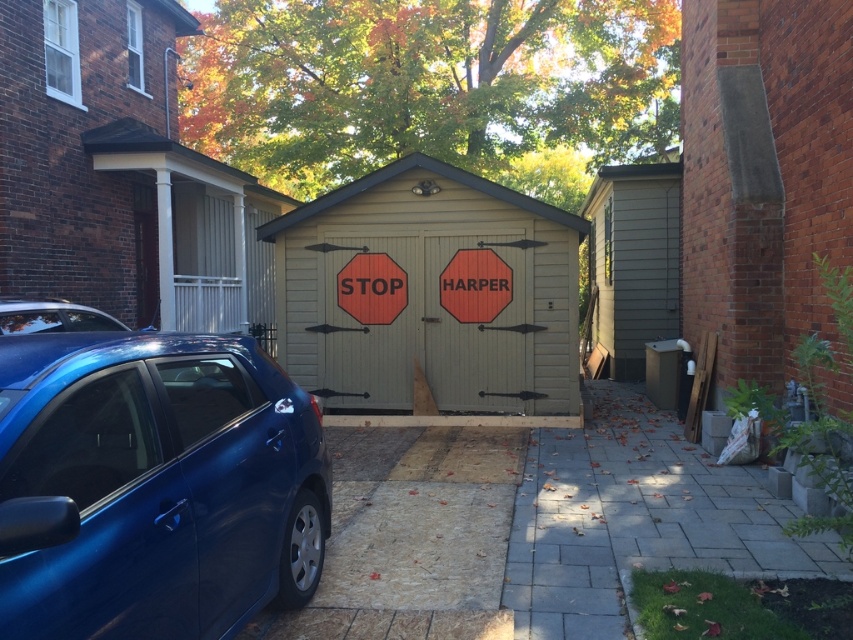
Can you confirm if smooth concrete driveway at center is positioned to the right of matte wood stop sign at center?

Indeed, smooth concrete driveway at center is positioned on the right side of matte wood stop sign at center.

This screenshot has width=853, height=640. What do you see at coordinates (413, 538) in the screenshot? I see `smooth concrete driveway at center` at bounding box center [413, 538].

Between point (473, 476) and point (393, 296), which one is positioned in front?

Point (473, 476)

Locate an element on the screen. smooth concrete driveway at center is located at coordinates (413, 538).

Does green siding at center have a lesser height compared to glossy blue car at left?

No.

Who is positioned more to the right, green siding at center or glossy blue car at left?

green siding at center is more to the right.

Identify the location of green siding at center. The height and width of the screenshot is (640, 853). (633, 260).

Between glossy blue car at lower left and beige wood garage at center, which one appears on the left side from the viewer's perspective?

glossy blue car at lower left

Is point (114, 509) farther from camera compared to point (456, 186)?

No.

This screenshot has width=853, height=640. Identify the location of glossy blue car at lower left. (154, 484).